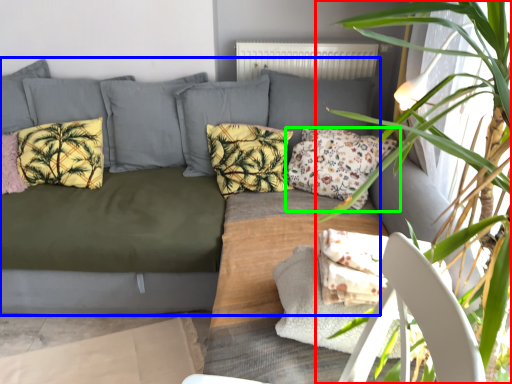
Question: Which is farther away from houseplant (highlighted by a red box)? studio couch (highlighted by a blue box) or pillow (highlighted by a green box)?

Choices:
 (A) studio couch
 (B) pillow

Answer: (A)